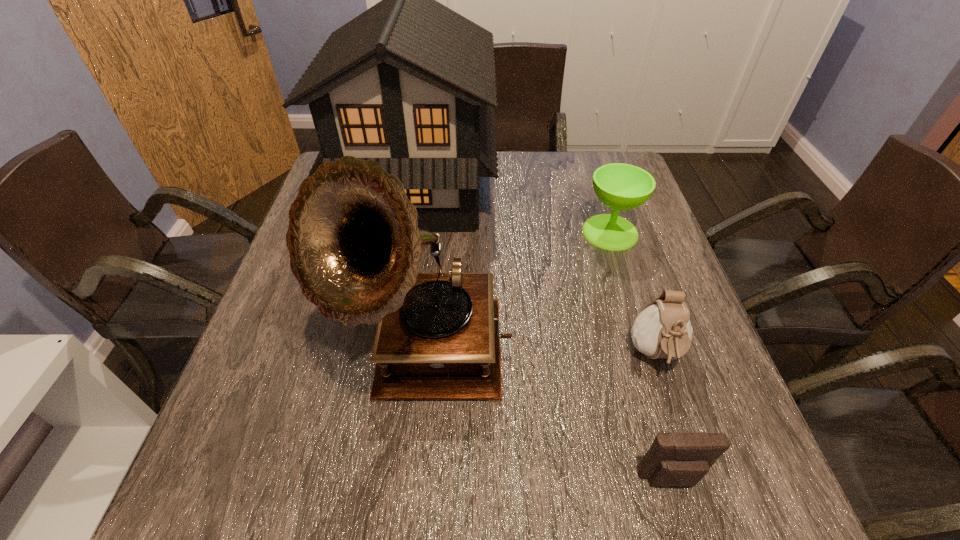
Locate an element on the screen. object that is positioned at the far edge is located at coordinates (409, 83).

Identify the location of object present at the near edge. The width and height of the screenshot is (960, 540). coord(678,458).

Identify the location of object positioned at the left edge. (409, 83).

You are a GUI agent. You are given a task and a screenshot of the screen. Output one action in this format:
    pyautogui.click(x=<x>, y=<y>)
    Task: Click on the wineglass located in the right edge section of the desktop
    The width and height of the screenshot is (960, 540).
    Given the screenshot: What is the action you would take?
    pyautogui.click(x=620, y=186)

The image size is (960, 540). I want to click on object that is at the far left corner, so click(409, 83).

You are a GUI agent. You are given a task and a screenshot of the screen. Output one action in this format:
    pyautogui.click(x=<x>, y=<y>)
    Task: Click on the object that is at the near right corner
    The width and height of the screenshot is (960, 540).
    Given the screenshot: What is the action you would take?
    pyautogui.click(x=678, y=458)

In the image, there is a desktop. Where is `vacant region at the far edge`? The width and height of the screenshot is (960, 540). vacant region at the far edge is located at coordinates (516, 153).

This screenshot has height=540, width=960. What are the coordinates of `blank space at the near edge` in the screenshot? It's located at (437, 509).

The width and height of the screenshot is (960, 540). What are the coordinates of `vacant region at the left edge` in the screenshot? It's located at (274, 433).

The width and height of the screenshot is (960, 540). In the image, there is a desktop. Identify the location of free region at the near right corner. (744, 495).